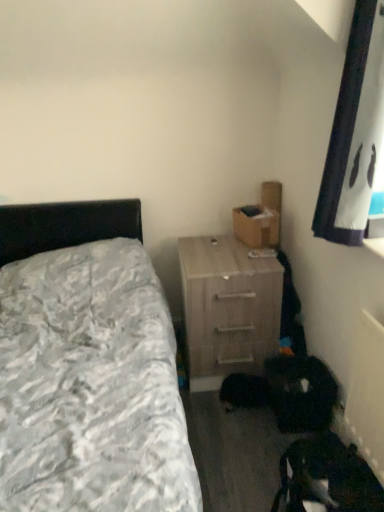
Question: Could you tell me if light wood/texture nightstand at center-right is facing brown cardboard box at upper right?

Choices:
 (A) yes
 (B) no

Answer: (B)

Question: Is brown cardboard box at upper right a part of light wood/texture nightstand at center-right?

Choices:
 (A) no
 (B) yes

Answer: (A)

Question: From a real-world perspective, is light wood/texture nightstand at center-right on top of brown cardboard box at upper right?

Choices:
 (A) no
 (B) yes

Answer: (A)

Question: Are light wood/texture nightstand at center-right and brown cardboard box at upper right beside each other?

Choices:
 (A) no
 (B) yes

Answer: (A)

Question: Can you confirm if light wood/texture nightstand at center-right is smaller than brown cardboard box at upper right?

Choices:
 (A) no
 (B) yes

Answer: (A)

Question: Is light wood/texture nightstand at center-right taller or shorter than brown cardboard box at upper right?

Choices:
 (A) short
 (B) tall

Answer: (B)

Question: Considering the positions of point (263, 326) and point (259, 216), is point (263, 326) closer or farther from the camera than point (259, 216)?

Choices:
 (A) farther
 (B) closer

Answer: (B)

Question: Considering their positions, is light wood/texture nightstand at center-right located in front of or behind brown cardboard box at upper right?

Choices:
 (A) front
 (B) behind

Answer: (A)

Question: Looking at their shapes, would you say light wood/texture nightstand at center-right is wider or thinner than brown cardboard box at upper right?

Choices:
 (A) thin
 (B) wide

Answer: (B)

Question: In the image, is textured gray bedspread at left positioned in front of or behind light wood/texture nightstand at center-right?

Choices:
 (A) behind
 (B) front

Answer: (B)

Question: Is textured gray bedspread at left bigger or smaller than light wood/texture nightstand at center-right?

Choices:
 (A) big
 (B) small

Answer: (A)

Question: From a real-world perspective, is textured gray bedspread at left positioned above or below light wood/texture nightstand at center-right?

Choices:
 (A) below
 (B) above

Answer: (B)

Question: Is textured gray bedspread at left inside the boundaries of light wood/texture nightstand at center-right, or outside?

Choices:
 (A) outside
 (B) inside

Answer: (A)

Question: Considering the positions of light wood/texture nightstand at center-right and textured gray bedspread at left in the image, is light wood/texture nightstand at center-right bigger or smaller than textured gray bedspread at left?

Choices:
 (A) big
 (B) small

Answer: (B)

Question: From the image's perspective, is light wood/texture nightstand at center-right located above or below textured gray bedspread at left?

Choices:
 (A) below
 (B) above

Answer: (B)